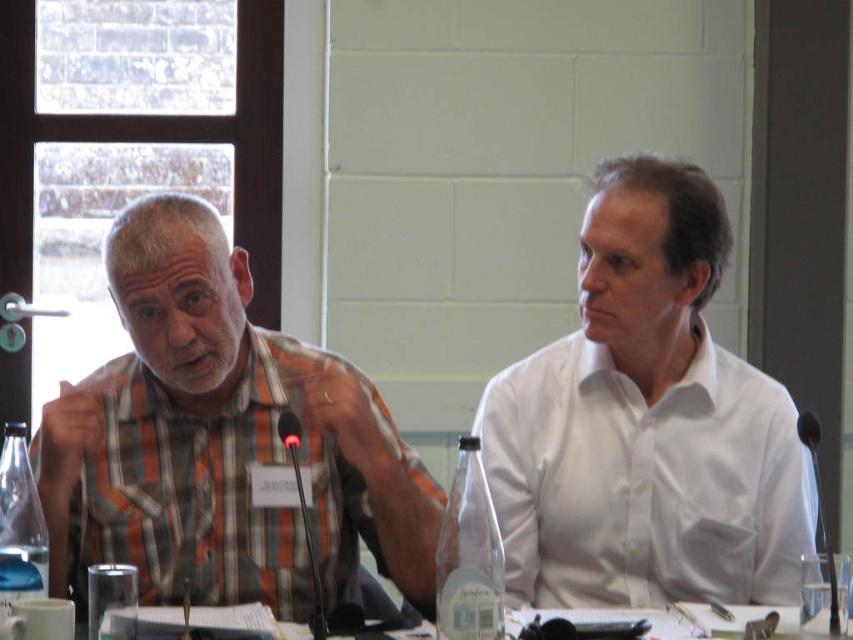
You are attending a meeting and need to hand a document to the person wearing the white smooth shirt at center. Since you are standing behind the table, which side should you approach from relative to the plaid shirt at left?

The white smooth shirt at center is positioned on the right side of the plaid shirt at left, so you should approach from the right side of the plaid shirt at left to reach the white smooth shirt at center.

What is the 2D coordinate of the white smooth shirt at center?

The white smooth shirt at center is located at the 2D coordinate point of (646, 422).